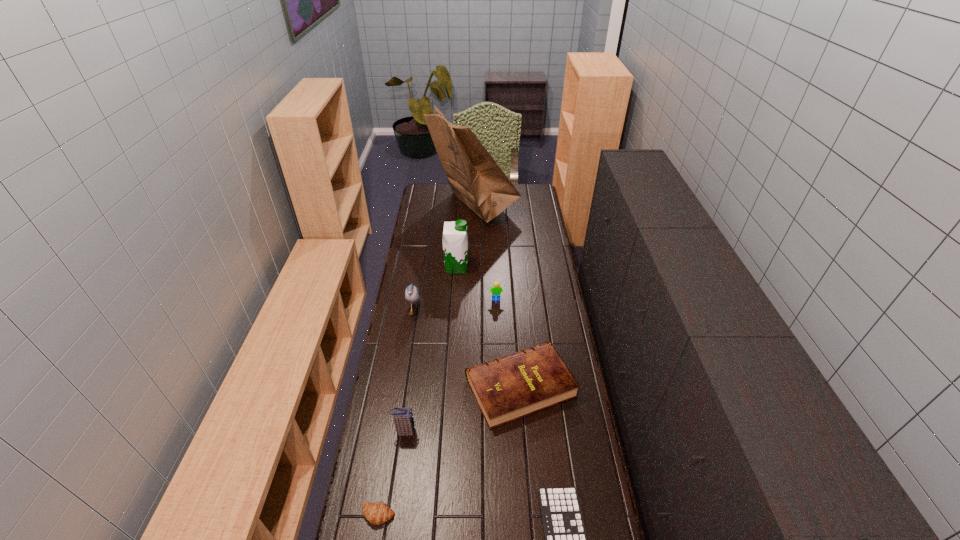
Locate an element on the screen. Image resolution: width=960 pixels, height=540 pixels. free region that satisfies the following two spatial constraints: 1. on the front side of the hardback book; 2. on the left side of the grocery bag is located at coordinates (469, 387).

You are a GUI agent. You are given a task and a screenshot of the screen. Output one action in this format:
    pyautogui.click(x=<x>, y=<y>)
    Task: Click on the vacant space that satisfies the following two spatial constraints: 1. on the back side of the crescent roll; 2. on the left side of the grocery bag
    The width and height of the screenshot is (960, 540).
    Given the screenshot: What is the action you would take?
    pyautogui.click(x=429, y=206)